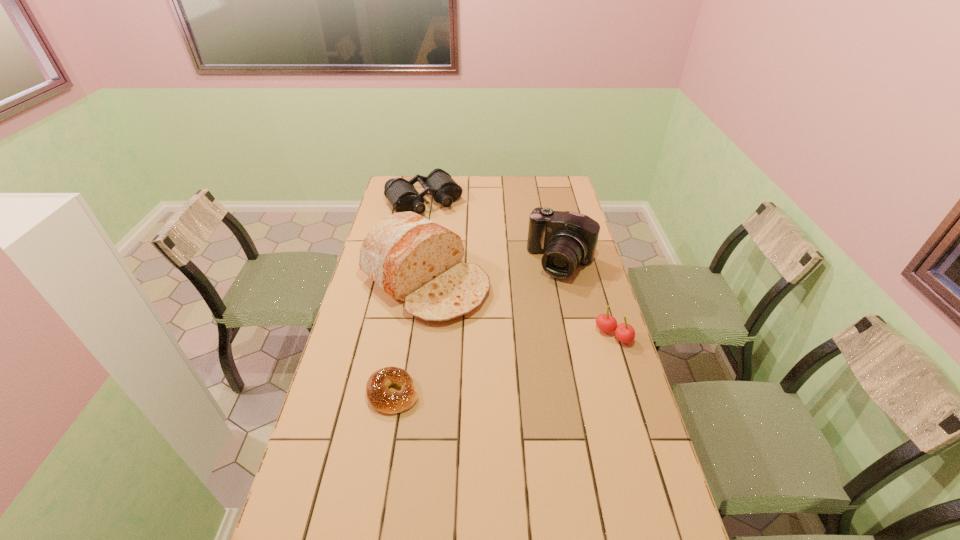
This screenshot has width=960, height=540. In order to click on the nearest object in this screenshot , I will do `click(381, 399)`.

I want to click on bagel, so click(x=381, y=399).

This screenshot has width=960, height=540. I want to click on cherry, so click(x=625, y=333).

You are a GUI agent. You are given a task and a screenshot of the screen. Output one action in this format:
    pyautogui.click(x=<x>, y=<y>)
    Task: Click on the bread
    The width and height of the screenshot is (960, 540).
    Given the screenshot: What is the action you would take?
    pyautogui.click(x=414, y=260)

Identify the location of the fourth shortest object. (567, 239).

This screenshot has width=960, height=540. Find the location of `the farthest object`. the farthest object is located at coordinates (402, 195).

The image size is (960, 540). I want to click on vacant space located on the back of the nearest object, so click(409, 302).

This screenshot has width=960, height=540. What are the coordinates of `free spot located 0.270m on the front of the cherry` in the screenshot? It's located at (639, 422).

Identify the location of vacant space situated at the sliced end of the tallest object. The height and width of the screenshot is (540, 960). (519, 345).

Where is `free location located 0.120m at the sliced end of the tallest object`? The image size is (960, 540). free location located 0.120m at the sliced end of the tallest object is located at coordinates (497, 329).